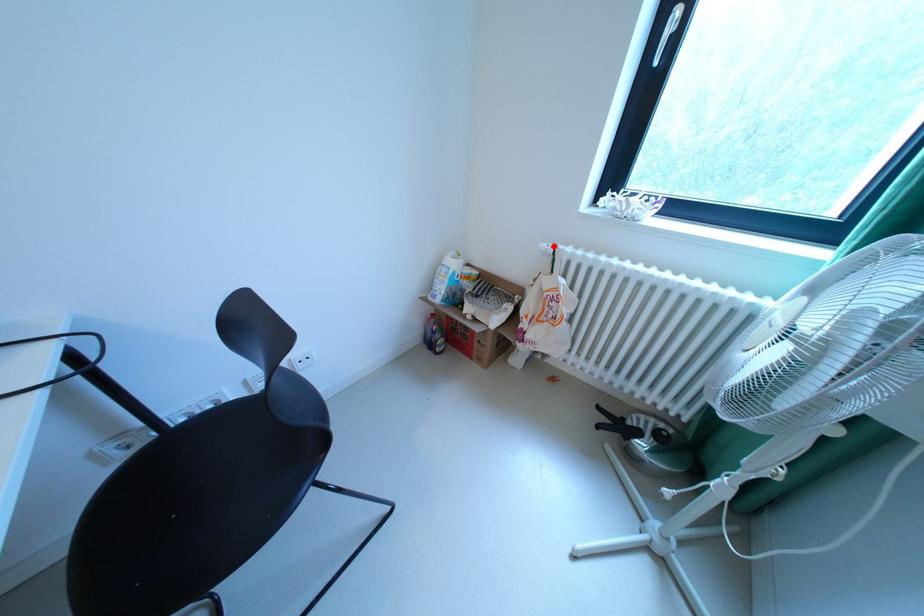
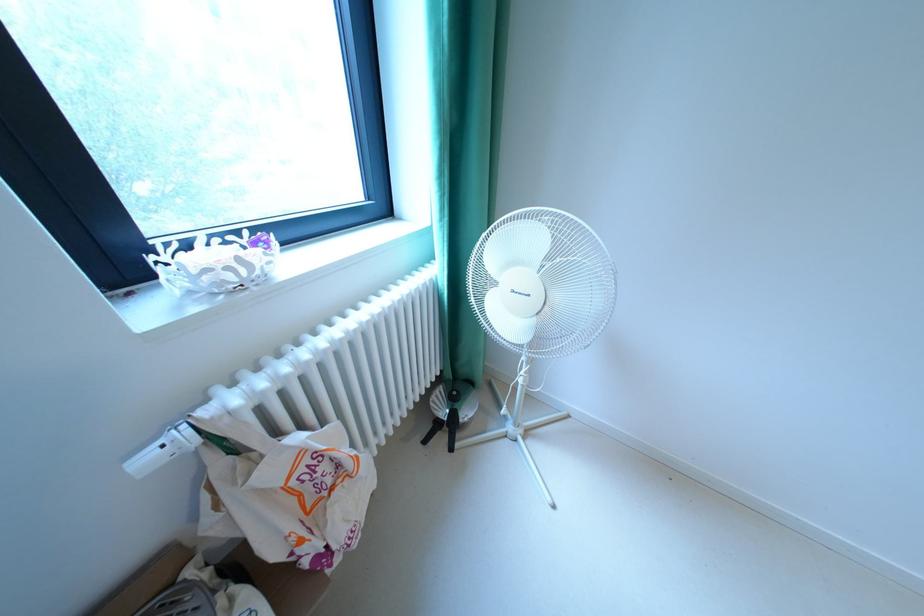
The point at the highlighted location is marked in the first image. Where is the corresponding point in the second image?

(156, 460)